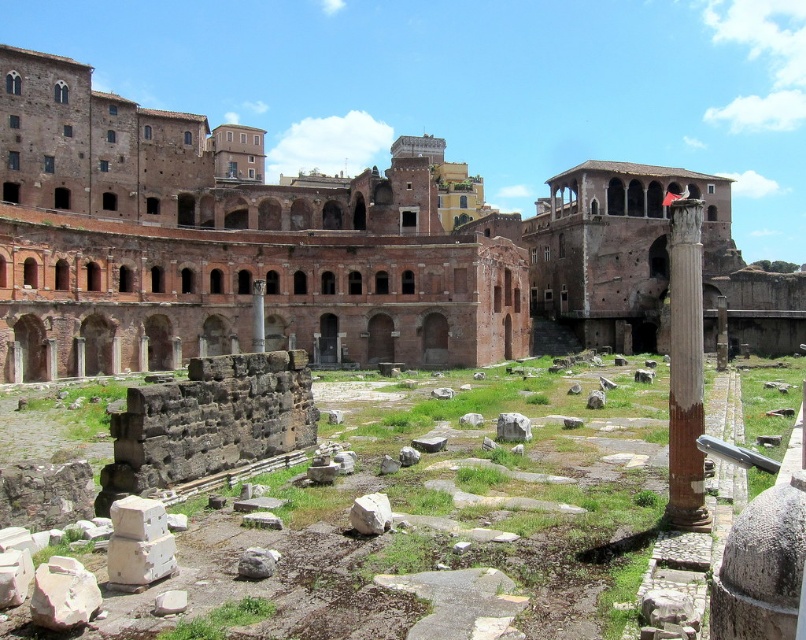
You are an archaeologist planning to walk from the rustic stone ruins at center to the smooth stone column at right. Given that your equipment can only carry items for a distance up to 17 meters, will you be able to transport your tools directly between these two points without needing to rest?

The rustic stone ruins at center and smooth stone column at right are 17.69 meters apart from each other. Since your equipment can only carry items for up to 17 meters, you will not be able to transport your tools directly between these two points without needing to rest.